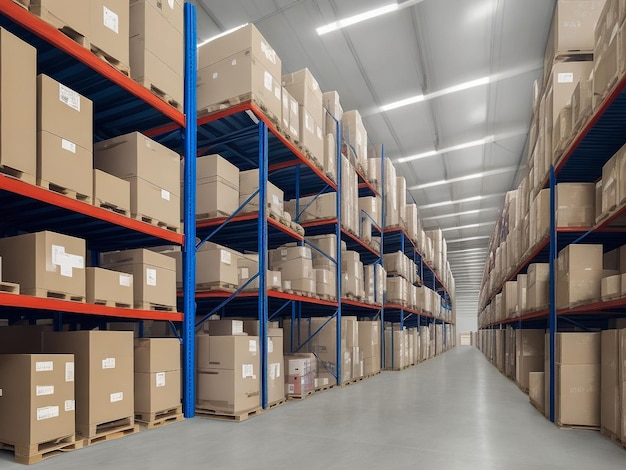
Locate an element on the screen. The width and height of the screenshot is (626, 470). orange shelves first 2 sections right side is located at coordinates (582, 307), (581, 137), (603, 220), (568, 230), (543, 182), (536, 313).